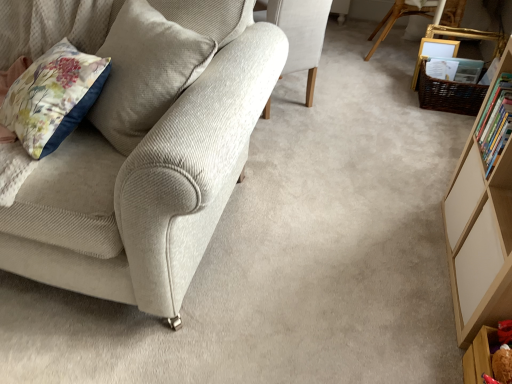
Question: In the image, is light wood bookcase at right on the left side or the right side of wooden chair at upper center, the 3th chair viewed from the front?

Choices:
 (A) left
 (B) right

Answer: (A)

Question: From a real-world perspective, is light wood bookcase at right positioned above or below wooden chair at upper center, the 3th chair viewed from the front?

Choices:
 (A) above
 (B) below

Answer: (A)

Question: Which object is positioned farthest from the wooden picture frame at upper right?

Choices:
 (A) hardcover book at right
 (B) light beige fabric chair at center, which appears as the 2th chair when viewed from the back
 (C) wooden shelf at lower right
 (D) light beige corduroy chair at left, marked as the 3th chair in a back-to-front arrangement
 (E) woven brown basket at upper right

Answer: (D)

Question: Which is nearer to the light beige fabric chair at center, the second chair in the right-to-left sequence?

Choices:
 (A) light beige corduroy chair at left, acting as the 1th chair starting from the front
 (B) wooden picture frame at upper right
 (C) hardcover book at right
 (D) wooden shelf at lower right
 (E) woven brown basket at upper right

Answer: (E)